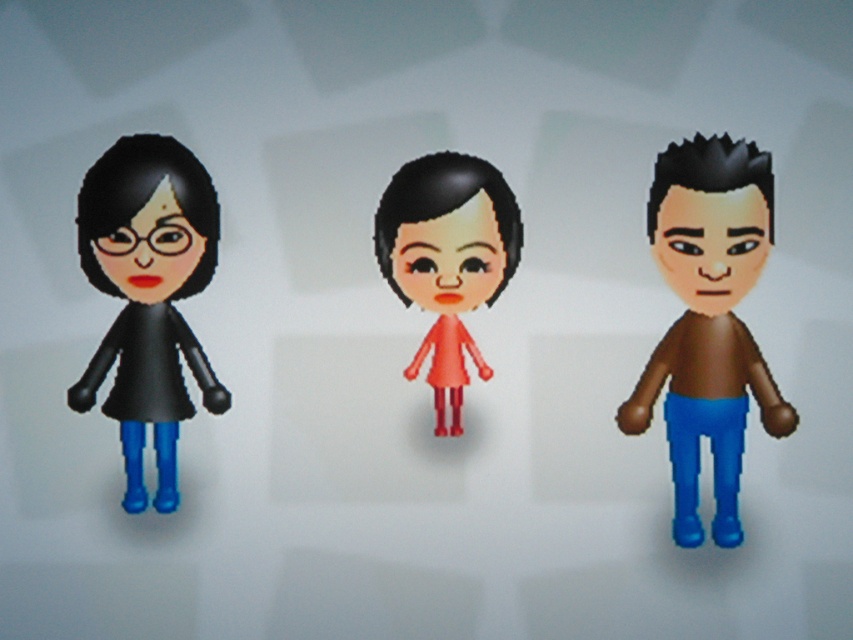
Question: Can you confirm if black matte doll at left is positioned below black matte hair at left?

Choices:
 (A) no
 (B) yes

Answer: (B)

Question: Which point is closer to the camera?

Choices:
 (A) (120, 406)
 (B) (703, 326)

Answer: (B)

Question: Estimate the real-world distances between objects in this image. Which object is farther from the black matte doll at left?

Choices:
 (A) brown matte shirt at right
 (B) black matte hair at left

Answer: (A)

Question: Among these points, which one is nearest to the camera?

Choices:
 (A) click(x=383, y=211)
 (B) click(x=746, y=152)
 (C) click(x=169, y=310)
 (D) click(x=730, y=456)

Answer: (B)

Question: Where is brown matte shirt at right located in relation to black matte doll at left in the image?

Choices:
 (A) right
 (B) left

Answer: (A)

Question: Can you confirm if black matte hair at center is positioned to the right of dark brown spiky hair at right?

Choices:
 (A) no
 (B) yes

Answer: (A)